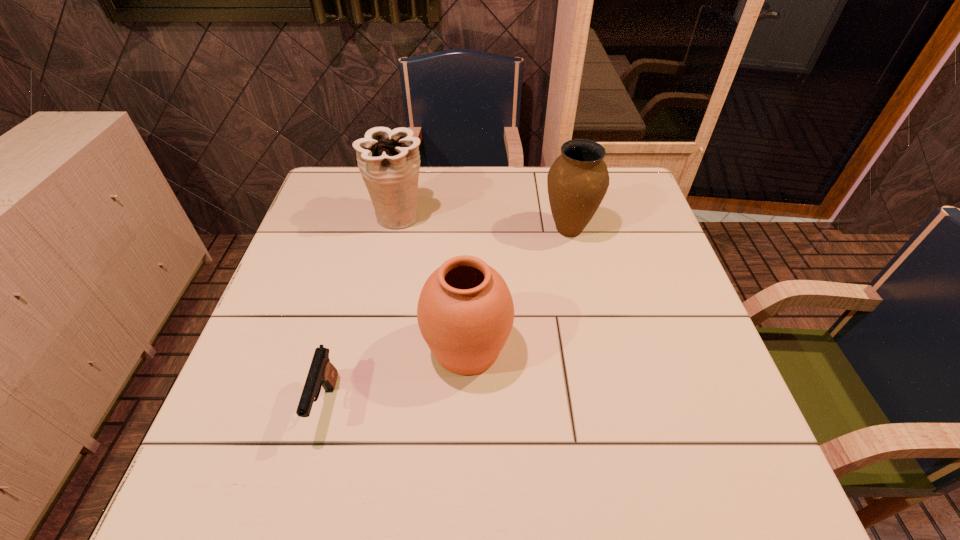
This screenshot has width=960, height=540. I want to click on object that is the second closest to the rightmost urn, so click(x=389, y=161).

Identify which object is the nearest to the leftmost urn. Please provide its 2D coordinates. Your answer should be formatted as a tuple, i.e. [(x, y)], where the tuple contains the x and y coordinates of a point satisfying the conditions above.

[(465, 312)]

I want to click on the closest urn relative to the second urn from right to left, so click(577, 181).

Locate which urn is the third closest to the pistol. Please provide its 2D coordinates. Your answer should be formatted as a tuple, i.e. [(x, y)], where the tuple contains the x and y coordinates of a point satisfying the conditions above.

[(577, 181)]